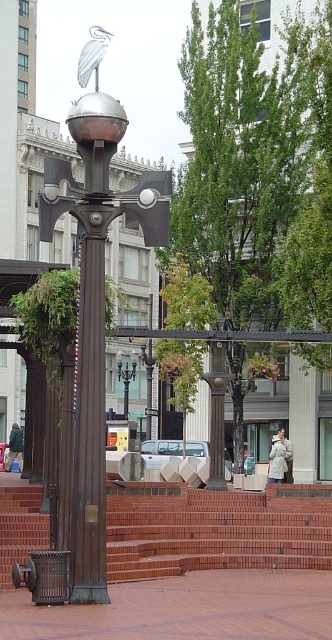
You are standing in the plaza and want to go up the brick stairs at center. Which direction should you walk relative to the bronze textured column at center?

You should walk to the left of the bronze textured column at center to reach the brick stairs at center since the brick stairs at center are located to the left of the bronze textured column at center.